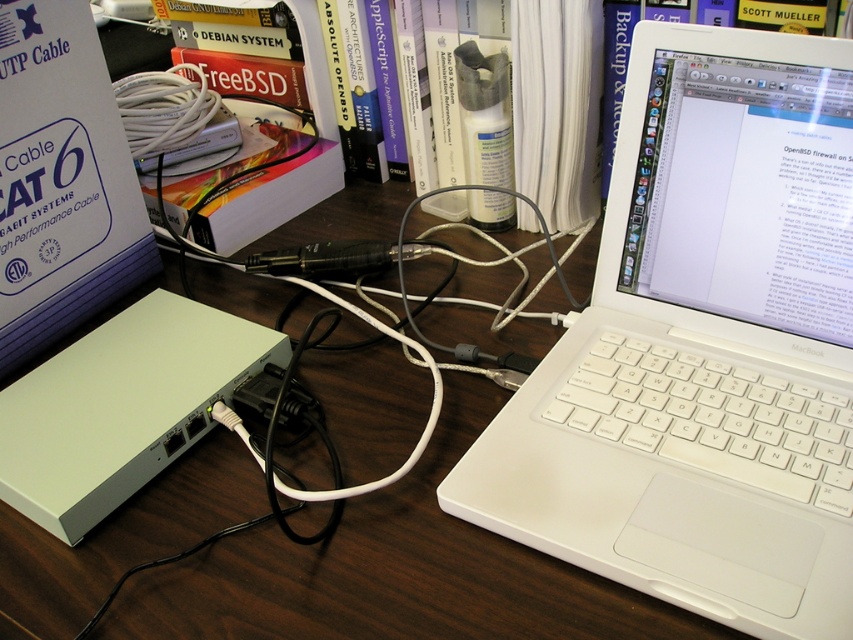
Question: Which point appears closest to the camera in this image?

Choices:
 (A) (569, 408)
 (B) (404, 620)

Answer: (B)

Question: Is white plastic laptop at center to the left of wooden table at center from the viewer's perspective?

Choices:
 (A) no
 (B) yes

Answer: (A)

Question: Where is white plastic laptop at center located in relation to wooden table at center in the image?

Choices:
 (A) below
 (B) above

Answer: (B)

Question: Is white plastic laptop at center below wooden table at center?

Choices:
 (A) yes
 (B) no

Answer: (B)